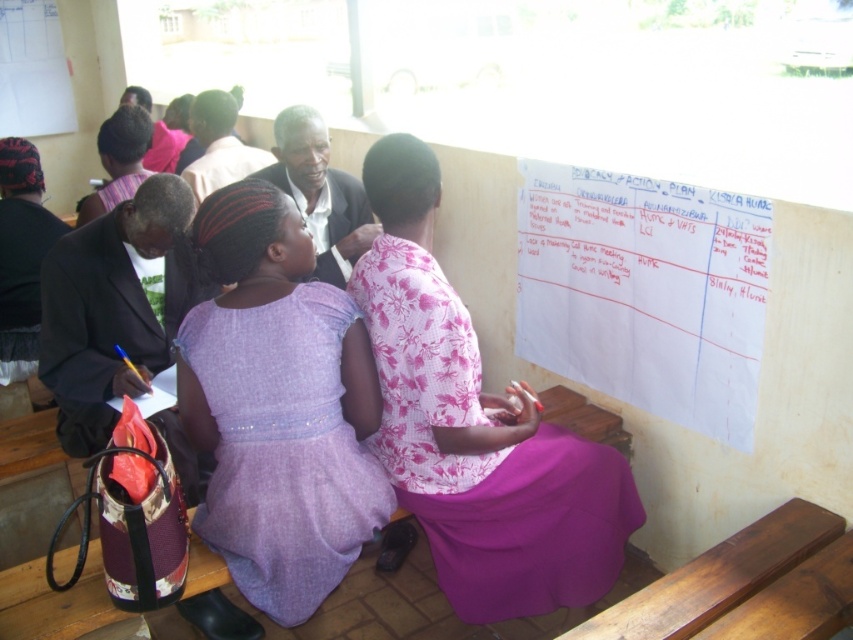
You are organizing a small event in a room with a pink floral fabric dress at center and a white paperboard at upper center. If you want to place a 1.5 meter wide banner between them, will there be enough space?

The pink floral fabric dress at center is wider than the white paperboard at upper center. However, the exact distance between them isn not specified in the provided information. Without knowing the distance between the two objects, it is impossible to determine if the 1.5 meter banner will fit.

You are an event planner organizing a meeting in this room. You need to place a large banner above the white paperboard at upper center. However, there is a pink floral fabric dress at center below it. Will the banner block the view of the dress when hung?

The pink floral fabric dress at center is positioned under the white paperboard at upper center. Hanging a banner above the white paperboard at upper center would place it even higher, so the banner would not block the view of the dress below.

You are organizing a meeting and need to place a 1.5 meter wide banner between the white paperboard at upper center and the purple satin dress at center. Can the banner fit horizontally between them?

The white paperboard at upper center is larger in size than the purple satin dress at center, but without specific distance information between them, it is impossible to determine if the banner will fit horizontally.